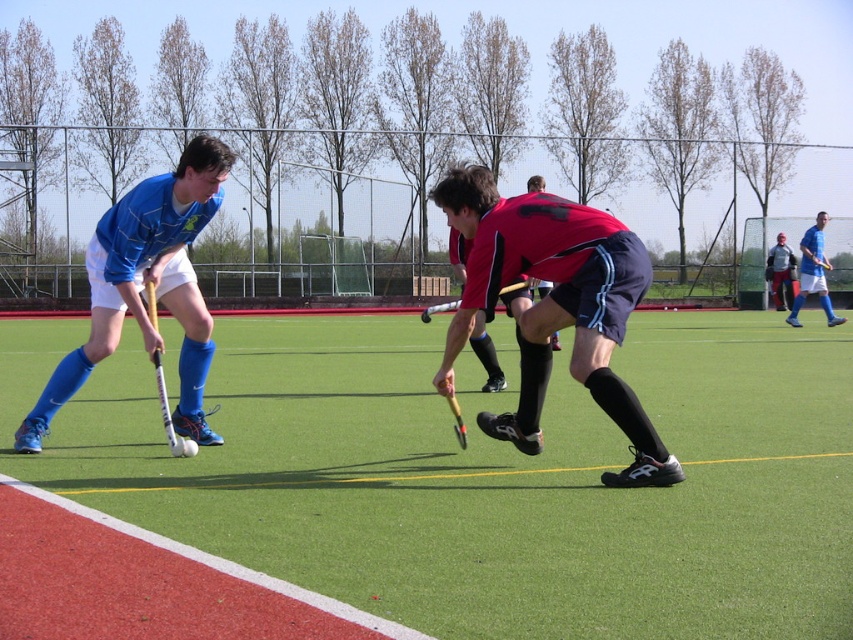
You are a referee observing the field hockey match. You notice the white glossy hockey stick at left and the wooden hockey stick at center. Which hockey stick is closer to the ground?

The white glossy hockey stick at left is positioned under the wooden hockey stick at center, so it is closer to the ground.

You are a field hockey coach analyzing the game from the sidelines. You notice the white glossy hockey stick at left on the field. Can you determine its exact coordinates on the field?

The white glossy hockey stick at left is located at coordinates point [167,410].